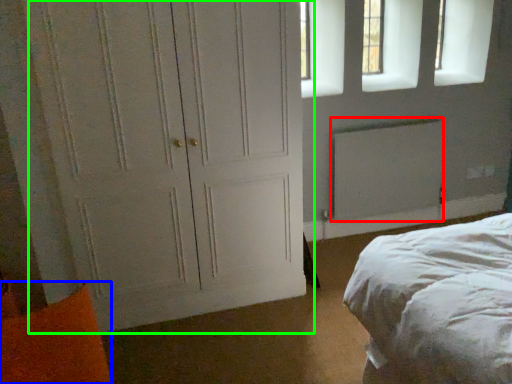
Question: Based on their relative distances, which object is farther from radiator (highlighted by a red box)? Choose from pillow (highlighted by a blue box) and door (highlighted by a green box).

Choices:
 (A) pillow
 (B) door

Answer: (A)